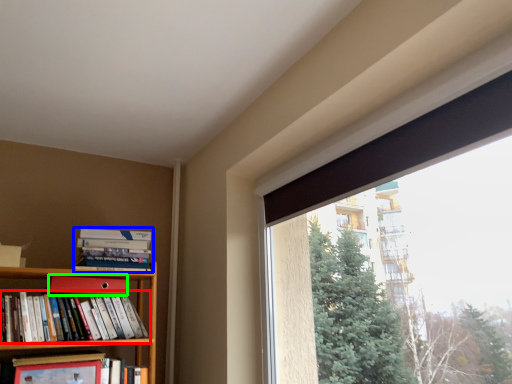
Question: Considering the real-world distances, which object is closest to book (highlighted by a red box)? book (highlighted by a blue box) or paperback book (highlighted by a green box).

Choices:
 (A) book
 (B) paperback book

Answer: (B)